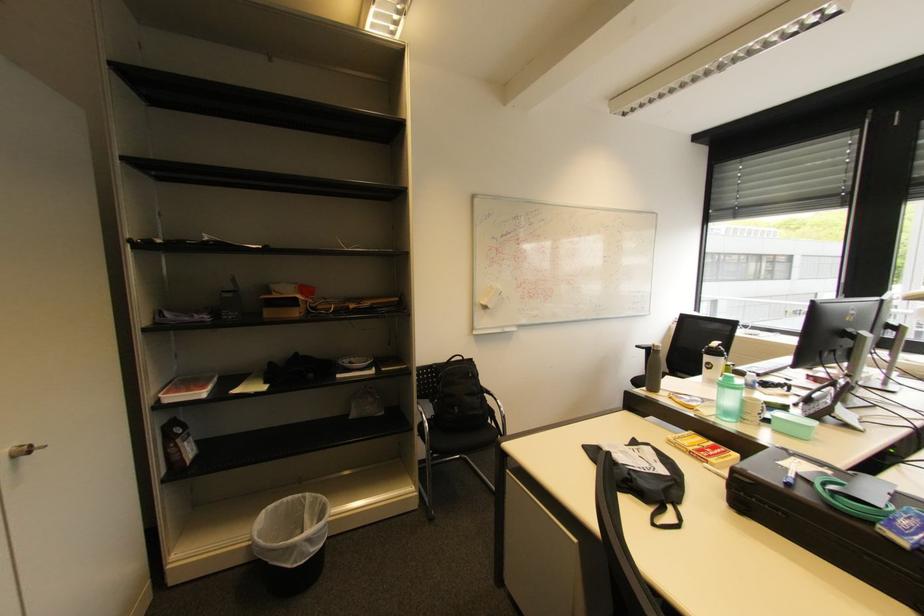
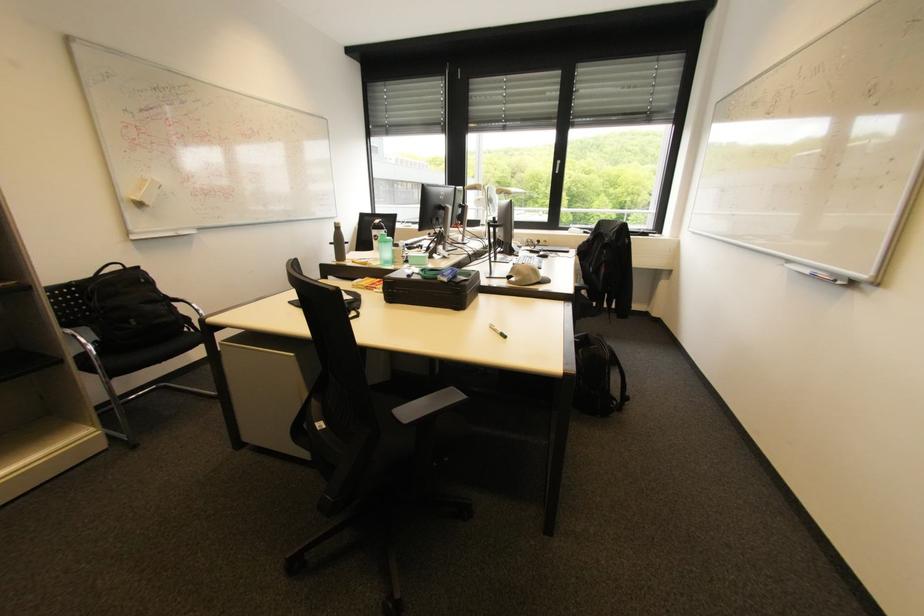
Find the pixel in the second image that matches point (476, 376) in the first image.

(148, 281)